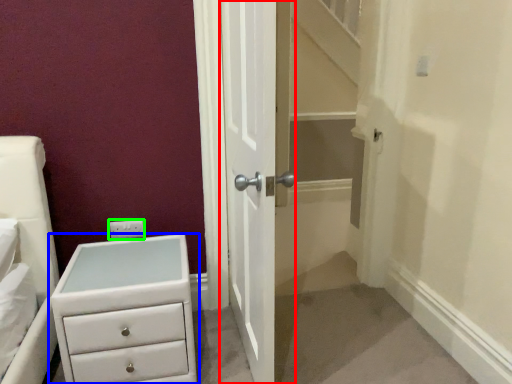
Question: Which object is positioned farthest from door (highlighted by a red box)? Select from chest of drawers (highlighted by a blue box) and electric outlet (highlighted by a green box).

Choices:
 (A) chest of drawers
 (B) electric outlet

Answer: (B)